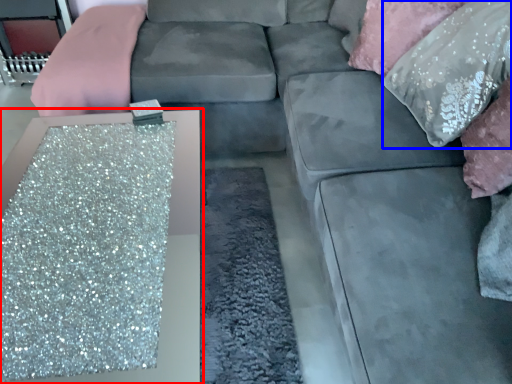
Question: Which object appears farthest to the camera in this image, table (highlighted by a red box) or pillow (highlighted by a blue box)?

Choices:
 (A) table
 (B) pillow

Answer: (B)